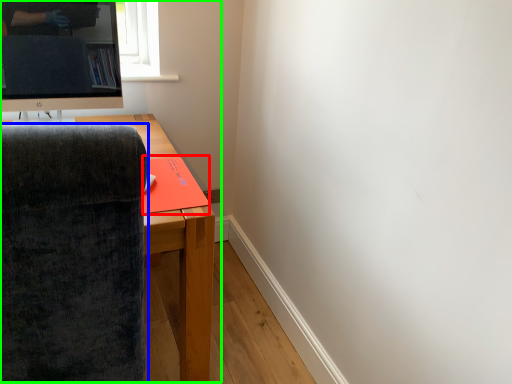
Question: Estimate the real-world distances between objects in this image. Which object is farther from book (highlighted by a red box), chair (highlighted by a blue box) or entertainment center (highlighted by a green box)?

Choices:
 (A) chair
 (B) entertainment center

Answer: (B)